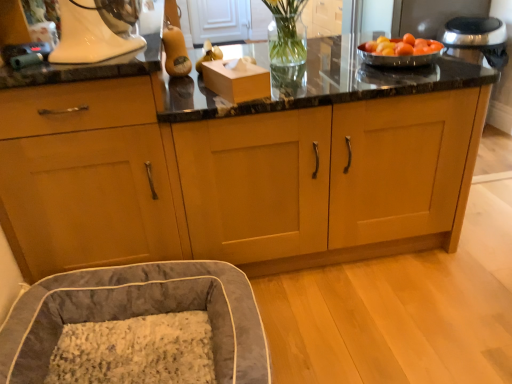
The height and width of the screenshot is (384, 512). I want to click on free space in front of matte wood cabinets at center, the 1th cabinetry in the right-to-left sequence, so click(381, 316).